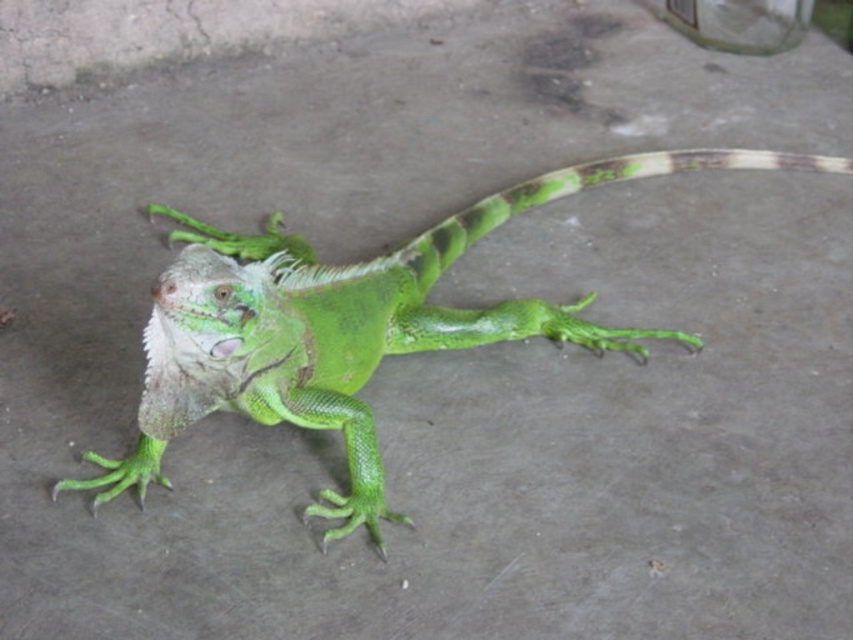
Question: Can you confirm if green matte lizard at center is smaller than green scaly tail at center?

Choices:
 (A) yes
 (B) no

Answer: (B)

Question: Which point is closer to the camera taking this photo?

Choices:
 (A) (216, 244)
 (B) (582, 177)

Answer: (A)

Question: Is green matte lizard at center to the left of green scaly tail at center from the viewer's perspective?

Choices:
 (A) no
 (B) yes

Answer: (B)

Question: Can you confirm if green matte lizard at center is positioned above green scaly tail at center?

Choices:
 (A) no
 (B) yes

Answer: (A)